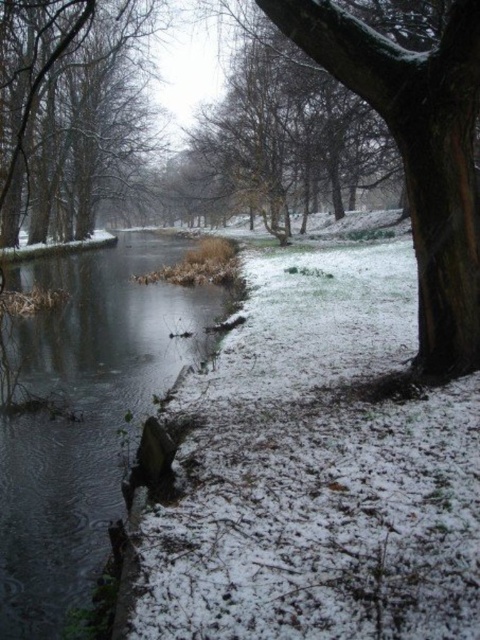
Question: Is clear water at center above smooth bark tree at left?

Choices:
 (A) yes
 (B) no

Answer: (B)

Question: Observing the image, what is the correct spatial positioning of clear water at center in reference to smooth bark tree at left?

Choices:
 (A) right
 (B) left

Answer: (A)

Question: Which point is closer to the camera taking this photo?

Choices:
 (A) (69, 204)
 (B) (34, 552)

Answer: (B)

Question: Does clear water at center have a greater width compared to smooth bark tree at left?

Choices:
 (A) no
 (B) yes

Answer: (A)

Question: Which point appears closest to the camera in this image?

Choices:
 (A) tap(25, 356)
 (B) tap(132, 132)

Answer: (A)

Question: Which object is closer to the camera taking this photo?

Choices:
 (A) smooth bark tree at left
 (B) clear water at center

Answer: (B)